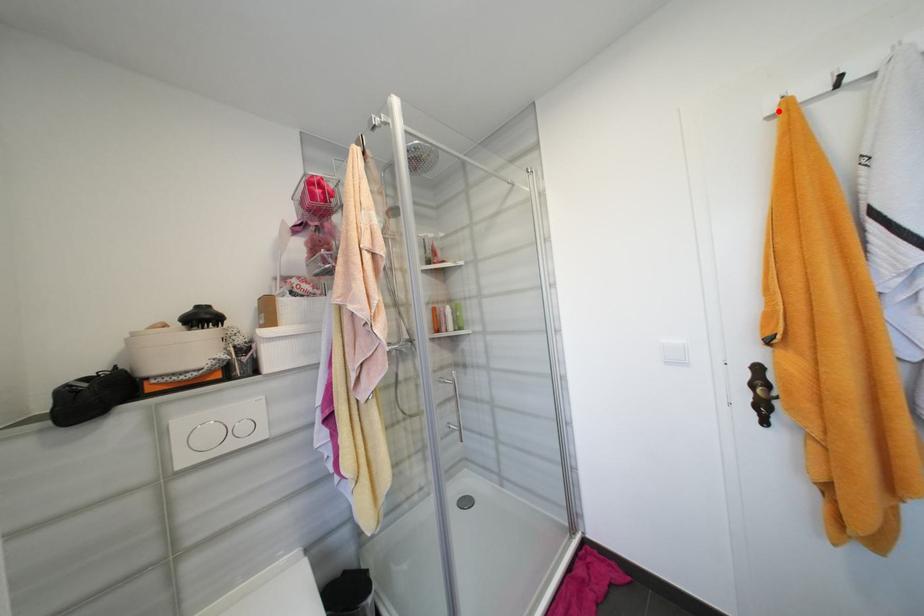
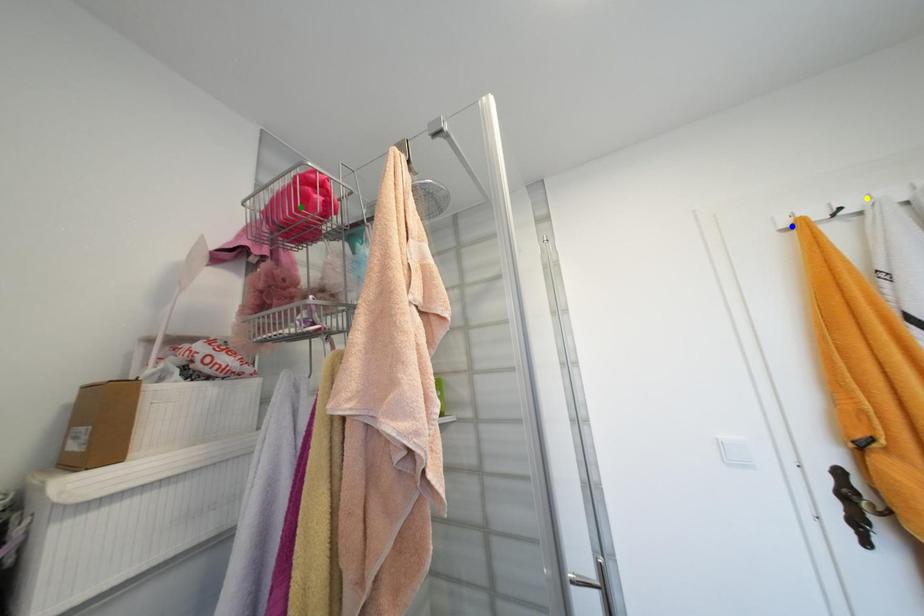
Question: I am providing you with two images of the same scene from different viewpoints. A red point is marked on the first image. You are given multiple points on the second image. Which point in image 2 is actually the same real-world point as the red point in image 1?

Choices:
 (A) green point
 (B) yellow point
 (C) blue point

Answer: (C)